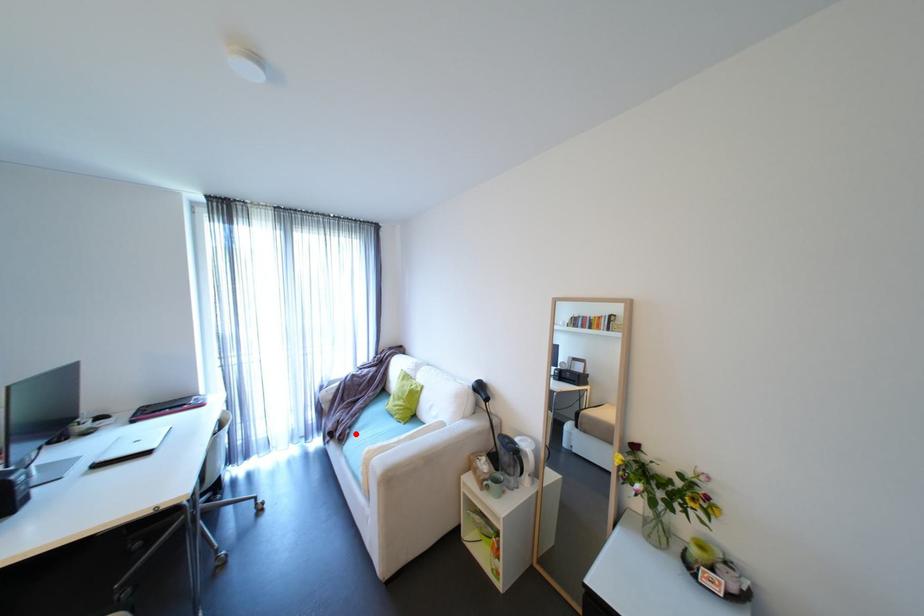
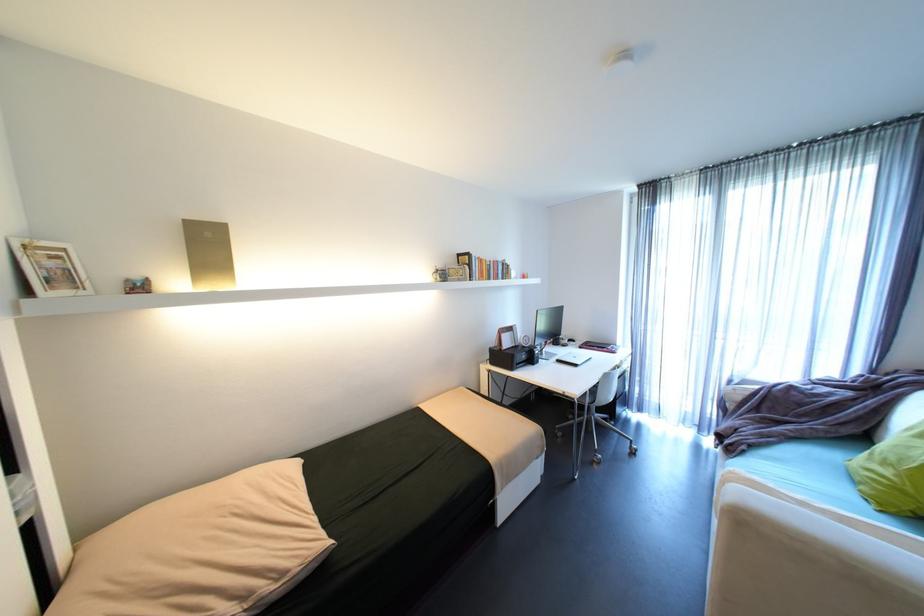
Find the pixel in the second image that matches the highlighted location in the first image.

(751, 451)